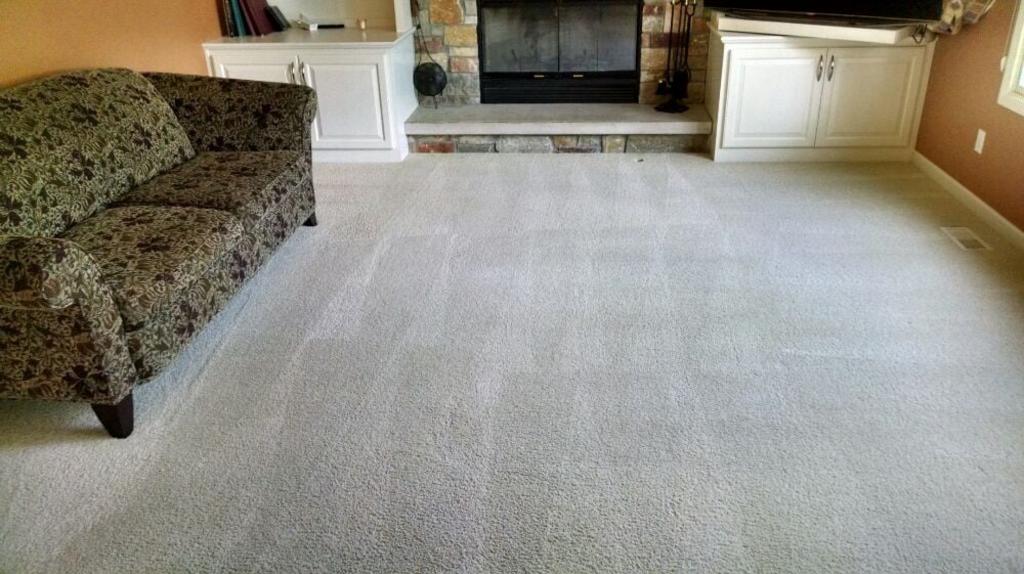
The height and width of the screenshot is (574, 1024). Identify the location of book. (251, 23).